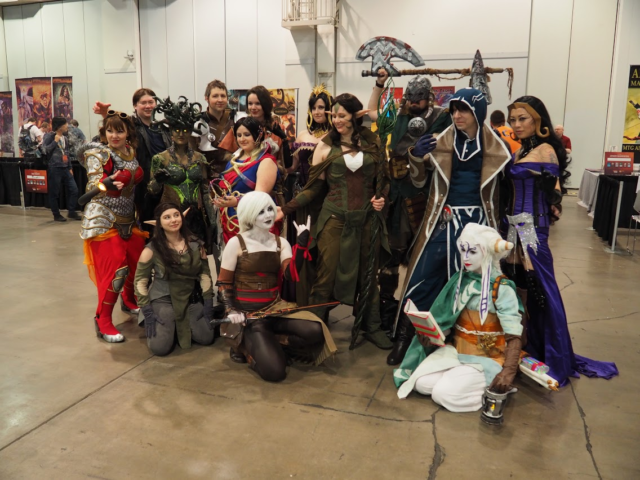
At what (x,y) coordinates should I click in order to perform the action: click on white wall. Please return your answer as a coordinate pair (x, y). This screenshot has width=640, height=480. Looking at the image, I should click on (54, 46), (496, 27), (591, 26).